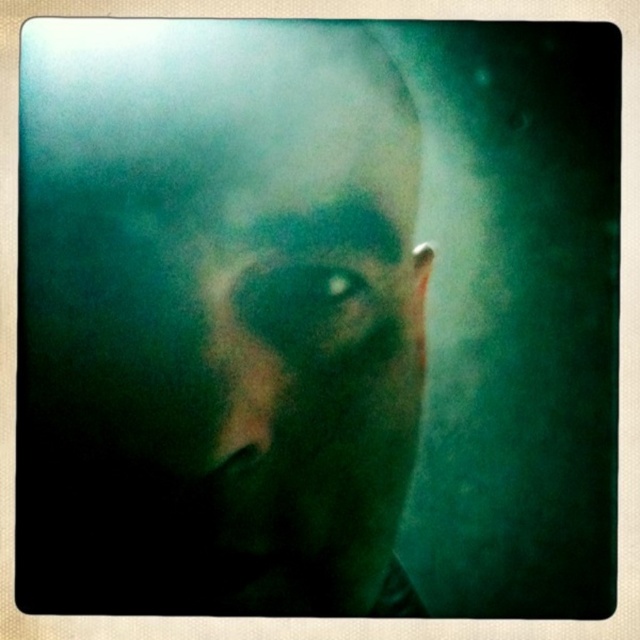
You are a photographer adjusting your camera settings to focus on two points in the image. The points are labeled as point (225,148) and point (256,310). Which point should you focus on first to ensure the closest object is sharp?

Point (225,148) is closer to the camera than point (256,310), so you should focus on point (225,148) first to ensure the closest object is sharp.

What are the coordinates of the matte green face at center in the image?

The matte green face at center is located at coordinates point (230, 289).

You are an artist analyzing a portrait. You notice the matte green face at center and the smokey green eye at center. Which object occupies more horizontal space in the image?

The matte green face at center occupies more horizontal space than the smokey green eye at center because its width is larger.